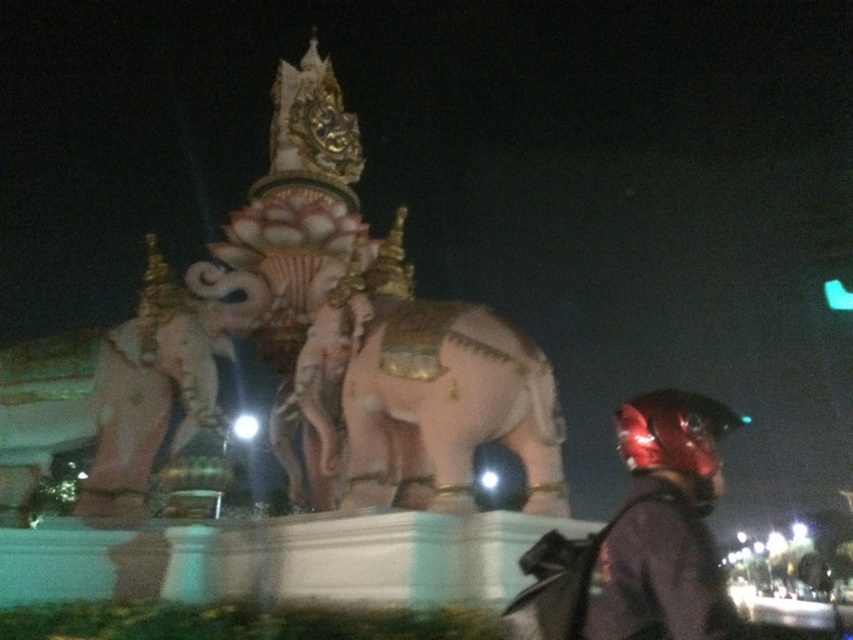
Is point (546, 451) more distant than point (624, 557)?

Yes, it is.

Which is behind, point (492, 422) or point (701, 563)?

The point (492, 422) is more distant.

Between point (479, 333) and point (651, 461), which one is positioned in front?

Point (651, 461) is in front.

Where is `smooth pinkish elephant at center`? This screenshot has width=853, height=640. smooth pinkish elephant at center is located at coordinates (445, 406).